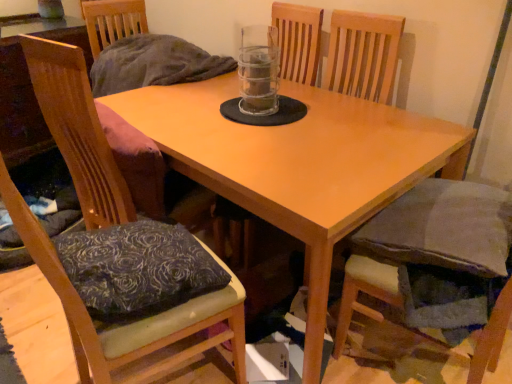
Question: From a real-world perspective, is transparent plastic beverage at center below wooden cushioned chair at left, the first chair viewed from the left?

Choices:
 (A) yes
 (B) no

Answer: (B)

Question: Is there a large distance between transparent plastic beverage at center and wooden cushioned chair at left, which ranks as the second chair in right-to-left order?

Choices:
 (A) no
 (B) yes

Answer: (A)

Question: Is transparent plastic beverage at center located outside wooden cushioned chair at left, the first chair viewed from the left?

Choices:
 (A) no
 (B) yes

Answer: (B)

Question: Considering the relative sizes of transparent plastic beverage at center and wooden cushioned chair at left, the first chair viewed from the left, in the image provided, is transparent plastic beverage at center wider than wooden cushioned chair at left, the first chair viewed from the left,?

Choices:
 (A) no
 (B) yes

Answer: (A)

Question: Is wooden cushioned chair at left, the first chair viewed from the left, at the back of transparent plastic beverage at center?

Choices:
 (A) yes
 (B) no

Answer: (B)

Question: Considering the positions of point (398, 314) and point (53, 107), is point (398, 314) closer or farther from the camera than point (53, 107)?

Choices:
 (A) closer
 (B) farther

Answer: (A)

Question: Is velvet gray cushion at lower right, the 2th chair viewed from the left, spatially inside wooden cushioned chair at left, which ranks as the second chair in right-to-left order, or outside of it?

Choices:
 (A) inside
 (B) outside

Answer: (B)

Question: Considering their positions, is velvet gray cushion at lower right, the 2th chair viewed from the left, located in front of or behind wooden cushioned chair at left, the first chair viewed from the left?

Choices:
 (A) behind
 (B) front

Answer: (A)

Question: Considering the positions of velvet gray cushion at lower right, the first chair when ordered from right to left, and wooden cushioned chair at left, which ranks as the second chair in right-to-left order, in the image, is velvet gray cushion at lower right, the first chair when ordered from right to left, bigger or smaller than wooden cushioned chair at left, which ranks as the second chair in right-to-left order,?

Choices:
 (A) big
 (B) small

Answer: (B)

Question: From the image's perspective, is satin dark blue pillow at lower left positioned above or below velvet gray cushion at lower right, the first chair when ordered from right to left?

Choices:
 (A) above
 (B) below

Answer: (A)

Question: Considering the positions of satin dark blue pillow at lower left and velvet gray cushion at lower right, the 2th chair viewed from the left, in the image, is satin dark blue pillow at lower left wider or thinner than velvet gray cushion at lower right, the 2th chair viewed from the left,?

Choices:
 (A) thin
 (B) wide

Answer: (B)

Question: From a real-world perspective, is satin dark blue pillow at lower left positioned above or below velvet gray cushion at lower right, the 2th chair viewed from the left?

Choices:
 (A) below
 (B) above

Answer: (B)

Question: Is satin dark blue pillow at lower left situated inside velvet gray cushion at lower right, the 2th chair viewed from the left, or outside?

Choices:
 (A) outside
 (B) inside

Answer: (A)

Question: From a real-world perspective, relative to velvet gray cushion at lower right, the first chair when ordered from right to left, is wooden cushioned chair at left, the first chair viewed from the left, vertically above or below?

Choices:
 (A) above
 (B) below

Answer: (A)

Question: Is wooden cushioned chair at left, which ranks as the second chair in right-to-left order, wider or thinner than velvet gray cushion at lower right, the first chair when ordered from right to left?

Choices:
 (A) thin
 (B) wide

Answer: (B)